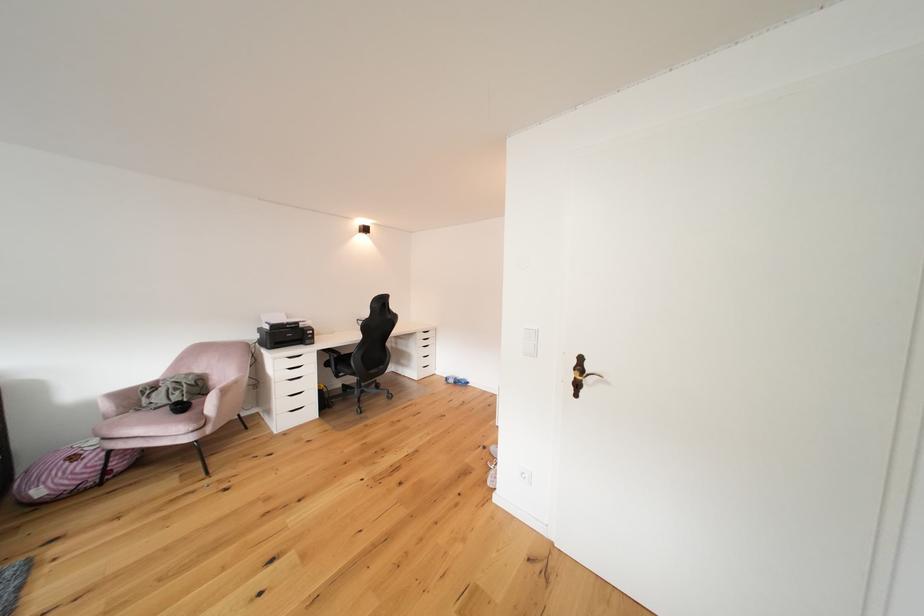
This screenshot has width=924, height=616. What do you see at coordinates (579, 375) in the screenshot?
I see `a brass door handle` at bounding box center [579, 375].